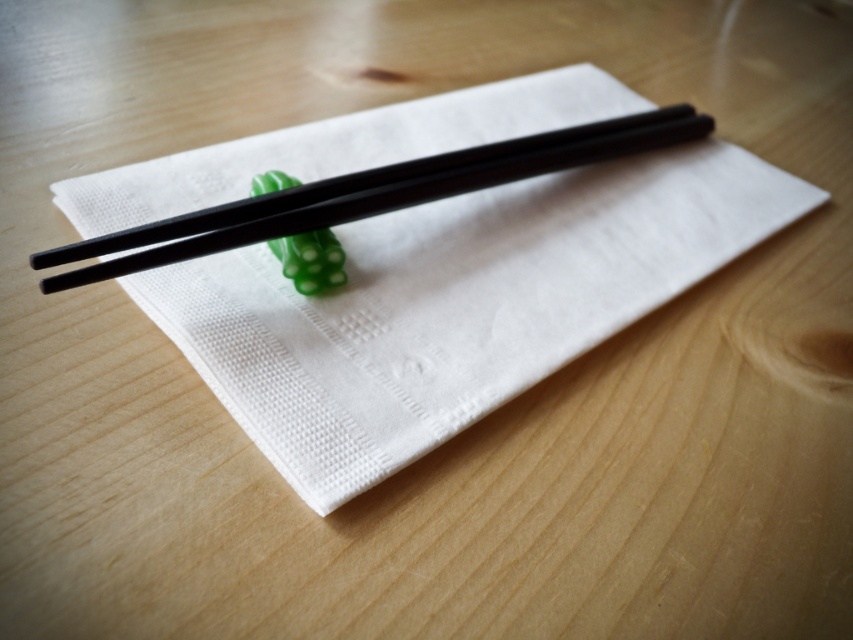
Is black glossy chopsticks at center in front of green rubbery toy at center?

Yes, it is in front of green rubbery toy at center.

Does black glossy chopsticks at center appear over green rubbery toy at center?

Yes, black glossy chopsticks at center is above green rubbery toy at center.

Describe the element at coordinates (369, 193) in the screenshot. This screenshot has height=640, width=853. I see `black glossy chopsticks at center` at that location.

This screenshot has height=640, width=853. Identify the location of black glossy chopsticks at center. (369, 193).